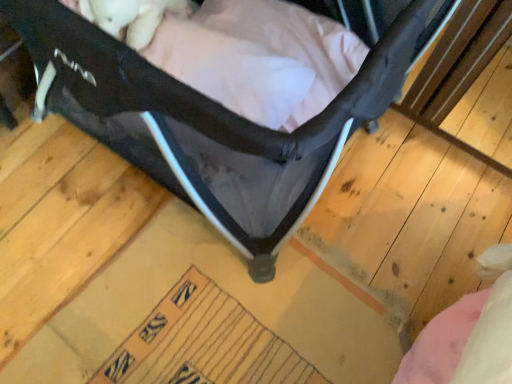
Where is `matte black crib at center`? matte black crib at center is located at coordinates (221, 108).

Image resolution: width=512 pixels, height=384 pixels. Describe the element at coordinates (221, 108) in the screenshot. I see `matte black crib at center` at that location.

Find the location of a particular element. The width and height of the screenshot is (512, 384). matte black crib at center is located at coordinates (221, 108).